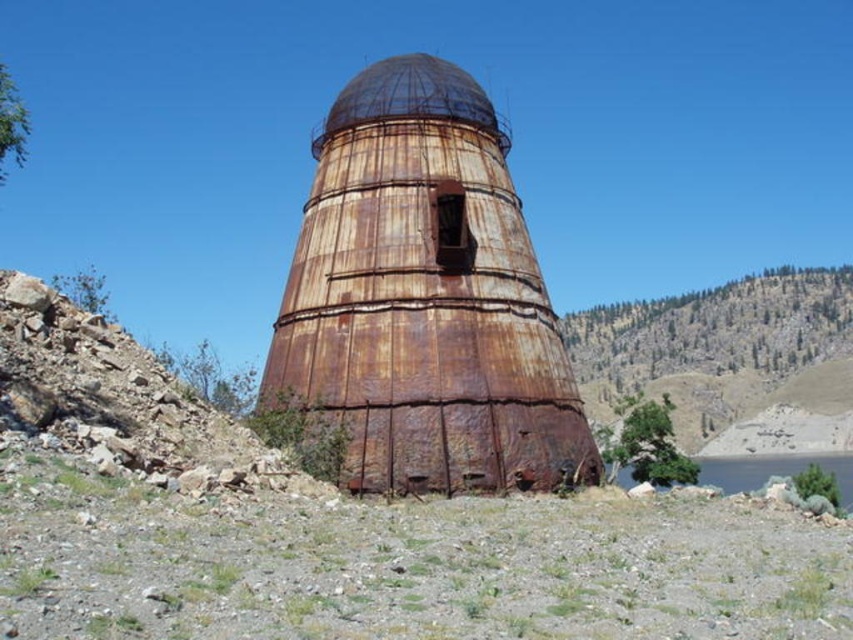
Can you confirm if green grassy hillside at upper center is wider than green grassy lake at lower right?

Yes, green grassy hillside at upper center is wider than green grassy lake at lower right.

Who is positioned more to the left, green grassy hillside at upper center or green grassy lake at lower right?

From the viewer's perspective, green grassy lake at lower right appears more on the left side.

Which is behind, point (822, 276) or point (813, 456)?

Point (822, 276)

The image size is (853, 640). What are the coordinates of `green grassy hillside at upper center` in the screenshot? It's located at (721, 348).

Does rusty metal dome at center have a smaller size compared to green grassy lake at lower right?

Yes.

Who is positioned more to the left, rusty metal dome at center or green grassy lake at lower right?

From the viewer's perspective, rusty metal dome at center appears more on the left side.

Identify the location of rusty metal dome at center. This screenshot has width=853, height=640. (410, 99).

Locate an element on the screen. rusty metal dome at center is located at coordinates (410, 99).

In the scene shown: Measure the distance between rusty metal tower at center and rusty metal dome at center.

35.15 feet

Between rusty metal tower at center and rusty metal dome at center, which one is positioned higher?

rusty metal dome at center is above.

Between point (335, 138) and point (404, 109), which one is positioned in front?

Point (404, 109) is more forward.

Where is `rusty metal tower at center`? The width and height of the screenshot is (853, 640). rusty metal tower at center is located at coordinates (424, 298).